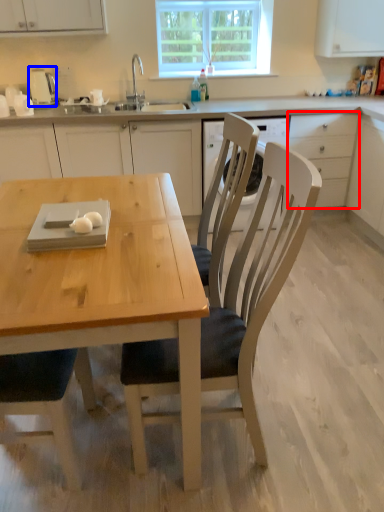
Question: Which object appears farthest to the camera in this image, drawer (highlighted by a red box) or appliance (highlighted by a blue box)?

Choices:
 (A) drawer
 (B) appliance

Answer: (B)